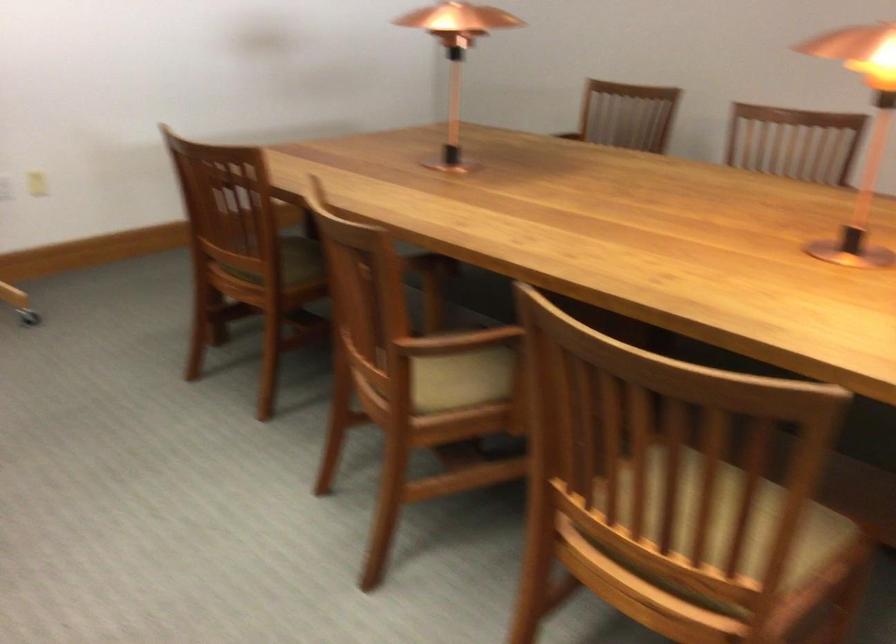
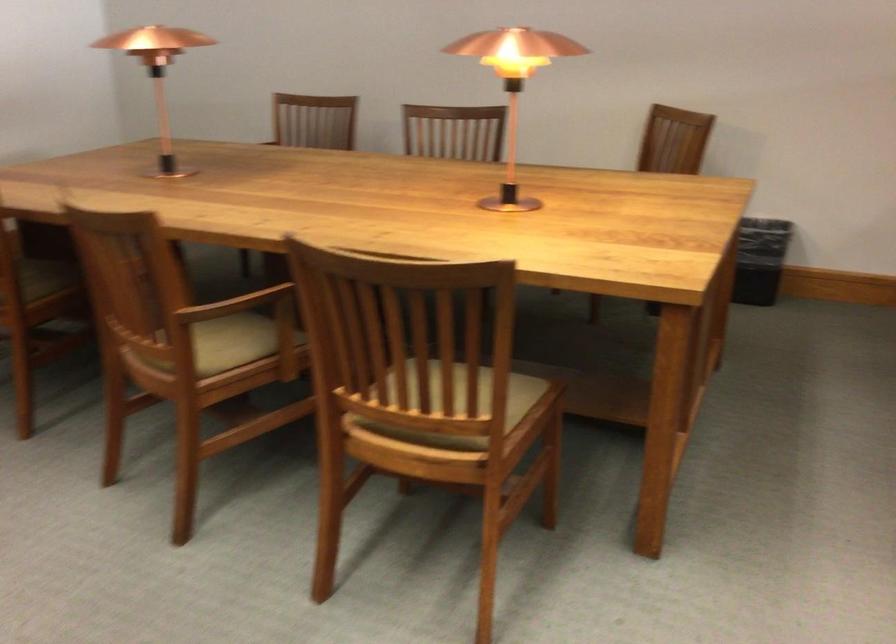
Find the pixel in the second image that matches pixel 622 203 in the first image.

(332, 189)